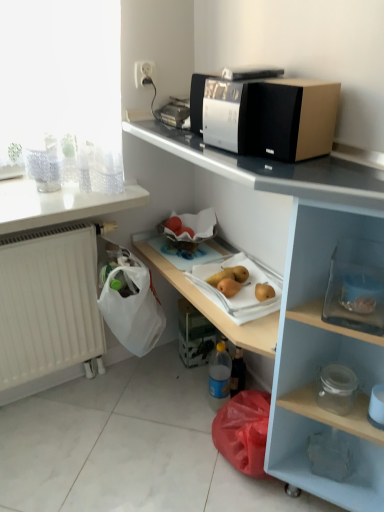
Locate an element on the screen. free point below white matte radiator at lower left (from a real-world perspective) is located at coordinates (62, 388).